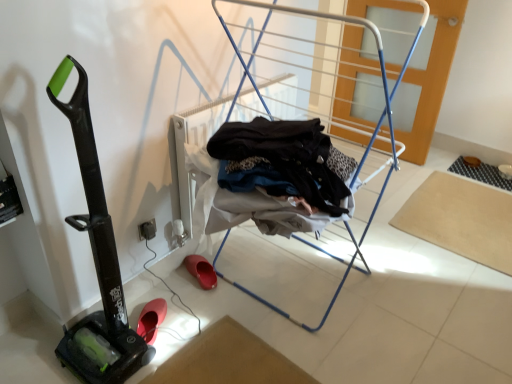
What are the coordinates of `vacant space behind beige fabric yoga mat at lower right` in the screenshot? It's located at (444, 167).